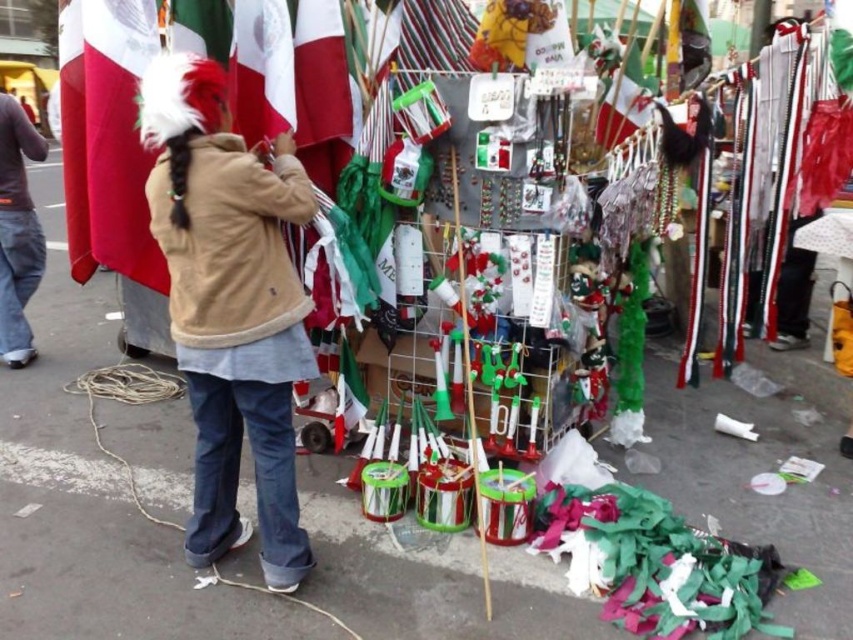
Question: Does matte brown jacket at center have a smaller size compared to matte green flag at upper center?

Choices:
 (A) no
 (B) yes

Answer: (A)

Question: Considering the real-world distances, which object is closest to the white fabric flag at upper left?

Choices:
 (A) red and white striped flag at upper left
 (B) matte brown jacket at center

Answer: (A)

Question: Among these objects, which one is nearest to the camera?

Choices:
 (A) denim jeans at left
 (B) red felt flag at upper left

Answer: (B)

Question: Which of these objects is positioned closest to the red felt flag at upper left?

Choices:
 (A) matte brown jacket at center
 (B) beige fleece jacket at center

Answer: (A)

Question: Is red felt flag at upper left closer to the viewer compared to red and white striped flag at upper left?

Choices:
 (A) no
 (B) yes

Answer: (B)

Question: Is matte green flag at upper center to the right of red and white striped flag at upper left from the viewer's perspective?

Choices:
 (A) yes
 (B) no

Answer: (A)